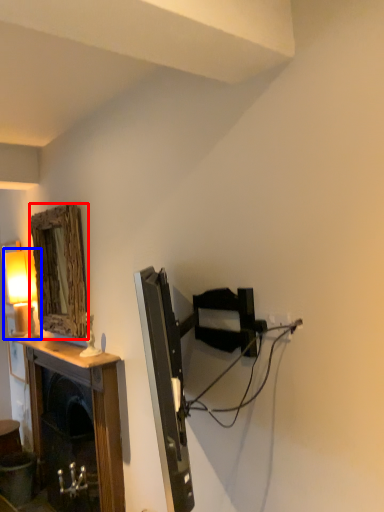
Question: Which object appears farthest to the camera in this image, mirror (highlighted by a red box) or table lamp (highlighted by a blue box)?

Choices:
 (A) mirror
 (B) table lamp

Answer: (B)